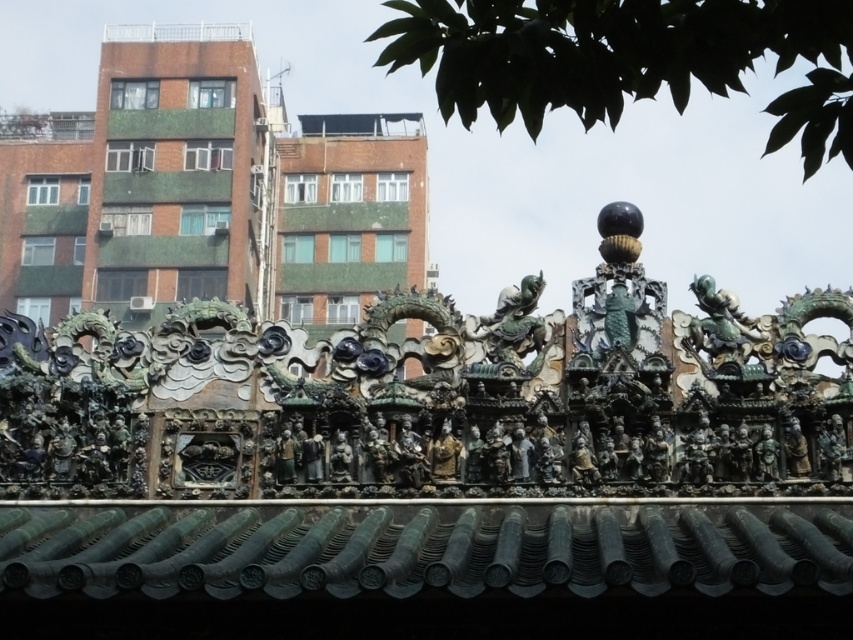
You are an architect examining the roof details of this traditional building. You notice the green patinated metal dragon at center and the green patinated metal figure at upper right. Which of these two objects is positioned farther away from the viewer?

The green patinated metal figure at upper right is positioned farther away from the viewer than the green patinated metal dragon at center because it is described as being behind the dragon.

You are a photographer standing at the camera position in the scene. You want to capture a closeup shot of the green patinated metal figure at upper right. Given that your camera has a maximum zoom range of 50 meters, can you achieve this without moving your position?

The green patinated metal figure at upper right is 68.86 meters away from camera, which is beyond the camera maximum zoom range of 50 meters. Therefore, you cannot achieve the closeup shot without moving your position.

In the scene depicting a traditional Chinese architectural detail with a modern urban backdrop, there is a green patinated metal dragon at center and a bronze statue at center. Which object is taller?

The green patinated metal dragon at center is taller than the bronze statue at center.